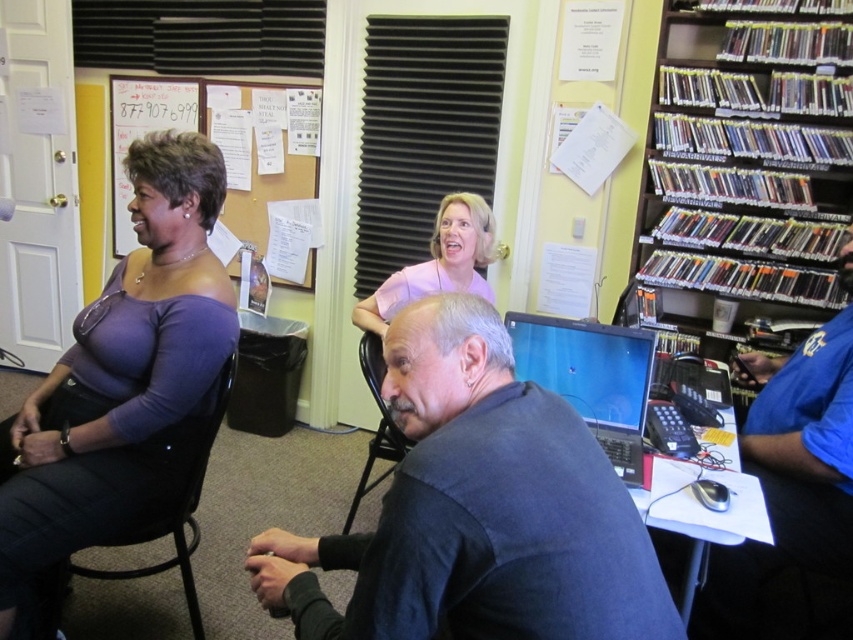
Question: Which point is farther to the camera?

Choices:
 (A) dark gray shirt at center
 (B) black plastic chair at lower center

Answer: (B)

Question: Is matte brown paper at upper left smaller than shiny black laptop at center?

Choices:
 (A) yes
 (B) no

Answer: (B)

Question: Estimate the real-world distances between objects in this image. Which object is farther from the purple matte top at left?

Choices:
 (A) matte brown paper at upper left
 (B) pink matte blouse at upper center

Answer: (A)

Question: Is purple matte top at left in front of blue shirt at right?

Choices:
 (A) no
 (B) yes

Answer: (B)

Question: Is purple matte top at left thinner than blue shirt at right?

Choices:
 (A) yes
 (B) no

Answer: (B)

Question: Which object appears farthest from the camera in this image?

Choices:
 (A) matte brown paper at upper left
 (B) wooden shelves at right
 (C) black plastic chair at lower center
 (D) pink matte blouse at upper center

Answer: (A)